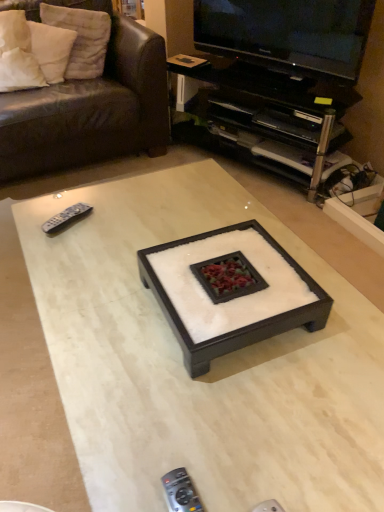
Locate an element on the screen. The height and width of the screenshot is (512, 384). free area in between black plastic remote control at lower center, which is the second remote control from back to front, and white felt square tray at center, positioned as the first coffee table in top-to-bottom order is located at coordinates (229, 408).